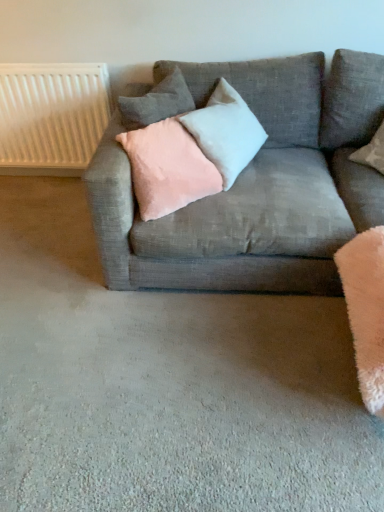
You are a GUI agent. You are given a task and a screenshot of the screen. Output one action in this format:
    pyautogui.click(x=<x>, y=<y>)
    Task: Click on the free spot above white textured radiator at upper left (from a real-world perspective)
    The image size is (384, 512).
    Given the screenshot: What is the action you would take?
    pyautogui.click(x=45, y=64)